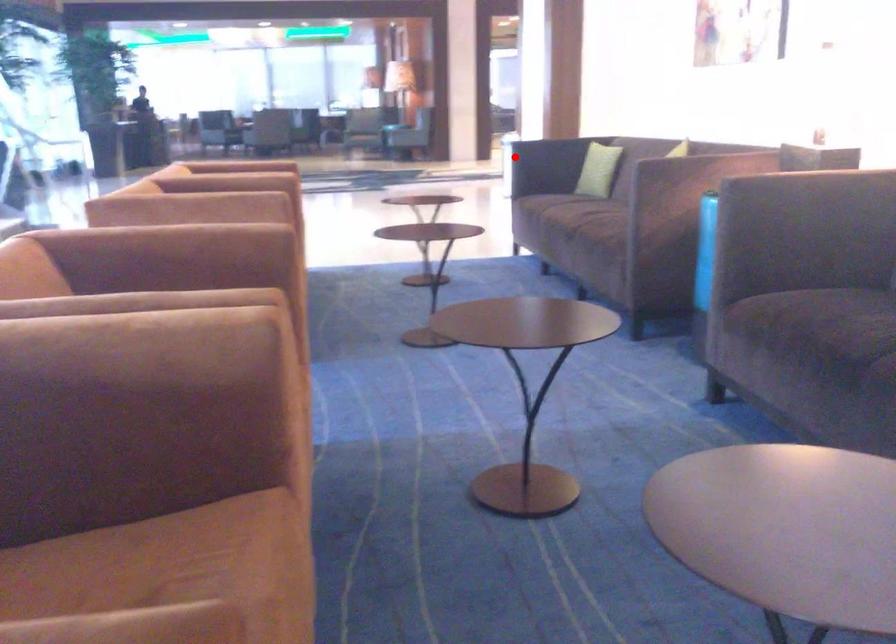
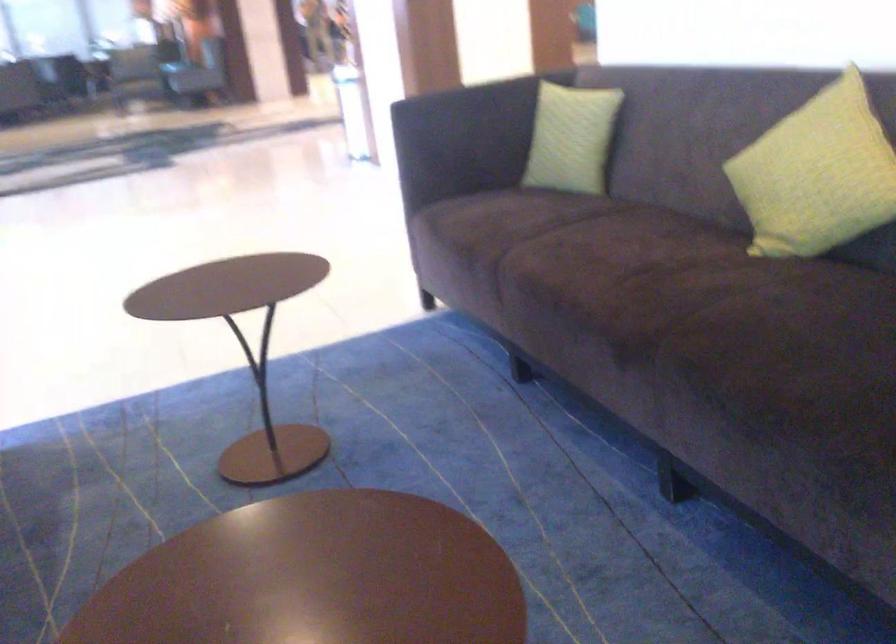
The point at the highlighted location is marked in the first image. Where is the corresponding point in the second image?

(509, 221)